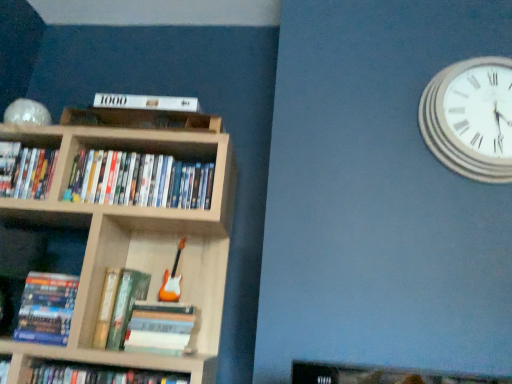
Question: Should I look upward or downward to see hardcover book at center, the 3th book from the right?

Choices:
 (A) down
 (B) up

Answer: (A)

Question: Considering the relative positions of matte plastic dvds at center, acting as the fourth book starting from the left, and hardcover book at lower center, marked as the fifth book in a left-to-right arrangement, in the image provided, is matte plastic dvds at center, acting as the fourth book starting from the left, to the left of hardcover book at lower center, marked as the fifth book in a left-to-right arrangement, from the viewer's perspective?

Choices:
 (A) no
 (B) yes

Answer: (B)

Question: Does matte plastic dvds at center, acting as the fourth book starting from the left, have a lesser width compared to hardcover book at lower center, marked as the fifth book in a left-to-right arrangement?

Choices:
 (A) no
 (B) yes

Answer: (A)

Question: Can you confirm if matte plastic dvds at center, acting as the fourth book starting from the left, is smaller than hardcover book at lower center, which ranks as the first book in right-to-left order?

Choices:
 (A) yes
 (B) no

Answer: (B)

Question: Does matte plastic dvds at center, acting as the fourth book starting from the left, have a larger size compared to hardcover book at lower center, marked as the fifth book in a left-to-right arrangement?

Choices:
 (A) yes
 (B) no

Answer: (A)

Question: Does matte plastic dvds at center, which ranks as the 2th book in right-to-left order, have a lesser height compared to hardcover book at lower center, marked as the fifth book in a left-to-right arrangement?

Choices:
 (A) yes
 (B) no

Answer: (B)

Question: From the image's perspective, is matte plastic dvds at center, which ranks as the 2th book in right-to-left order, located above hardcover book at lower center, which ranks as the first book in right-to-left order?

Choices:
 (A) yes
 (B) no

Answer: (A)

Question: Is wooden bookcase at center closer to the viewer compared to hardcover book at center, which ranks as the third book in left-to-right order?

Choices:
 (A) no
 (B) yes

Answer: (B)

Question: Considering the relative positions of wooden bookcase at center and hardcover book at center, which ranks as the third book in left-to-right order, in the image provided, is wooden bookcase at center behind hardcover book at center, which ranks as the third book in left-to-right order,?

Choices:
 (A) yes
 (B) no

Answer: (B)

Question: Is wooden bookcase at center to the right of hardcover book at center, the 3th book from the right, from the viewer's perspective?

Choices:
 (A) no
 (B) yes

Answer: (A)

Question: Can you confirm if wooden bookcase at center is smaller than hardcover book at center, which ranks as the third book in left-to-right order?

Choices:
 (A) yes
 (B) no

Answer: (B)

Question: Is wooden bookcase at center shorter than hardcover book at center, which ranks as the third book in left-to-right order?

Choices:
 (A) yes
 (B) no

Answer: (B)

Question: Is wooden bookcase at center bigger than hardcover book at center, which ranks as the third book in left-to-right order?

Choices:
 (A) no
 (B) yes

Answer: (B)

Question: Is wooden bookcase at center not inside matte black book at upper left, acting as the fifth book starting from the right?

Choices:
 (A) yes
 (B) no

Answer: (A)